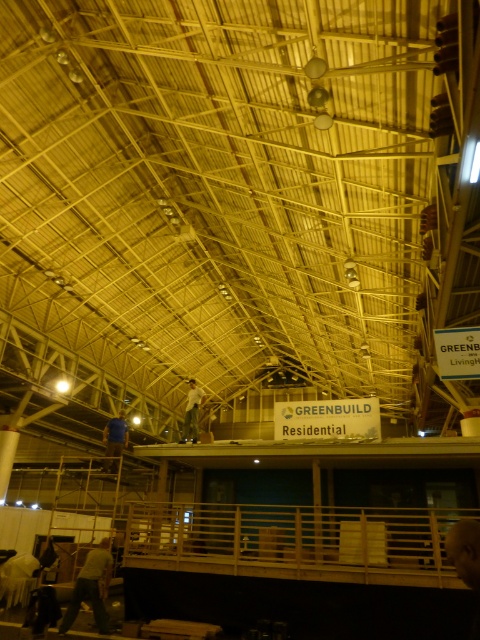
Which is in front, point (72, 608) or point (204, 394)?

Point (72, 608) is more forward.

You are a GUI agent. You are given a task and a screenshot of the screen. Output one action in this format:
    pyautogui.click(x=<x>, y=<y>)
    Task: Click on the light gray fabric pants at lower left
    The width and height of the screenshot is (480, 640).
    Given the screenshot: What is the action you would take?
    pyautogui.click(x=91, y=588)

Can you confirm if blue fabric at center is positioned to the right of white cotton shirt at center?

No, blue fabric at center is not to the right of white cotton shirt at center.

Does blue fabric at center have a lesser height compared to white cotton shirt at center?

Indeed, blue fabric at center has a lesser height compared to white cotton shirt at center.

Does point (119, 428) lie in front of point (187, 422)?

That is True.

Locate an element on the screen. Image resolution: width=480 pixels, height=640 pixels. blue fabric at center is located at coordinates (115, 442).

Consider the image. Who is higher up, light gray fabric pants at lower left or blue fabric at center?

blue fabric at center is above.

Which is behind, point (96, 580) or point (105, 458)?

Point (105, 458)

This screenshot has height=640, width=480. I want to click on light gray fabric pants at lower left, so click(91, 588).